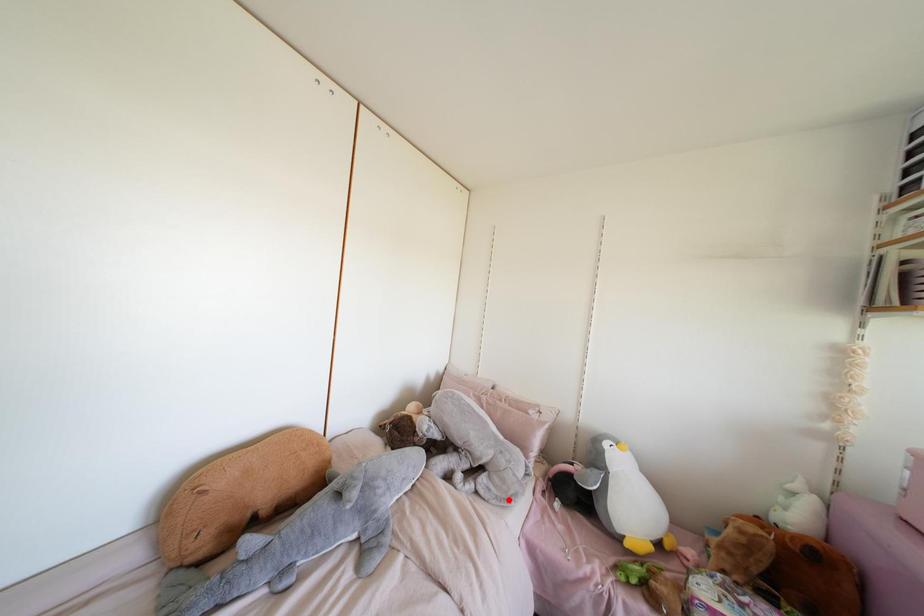
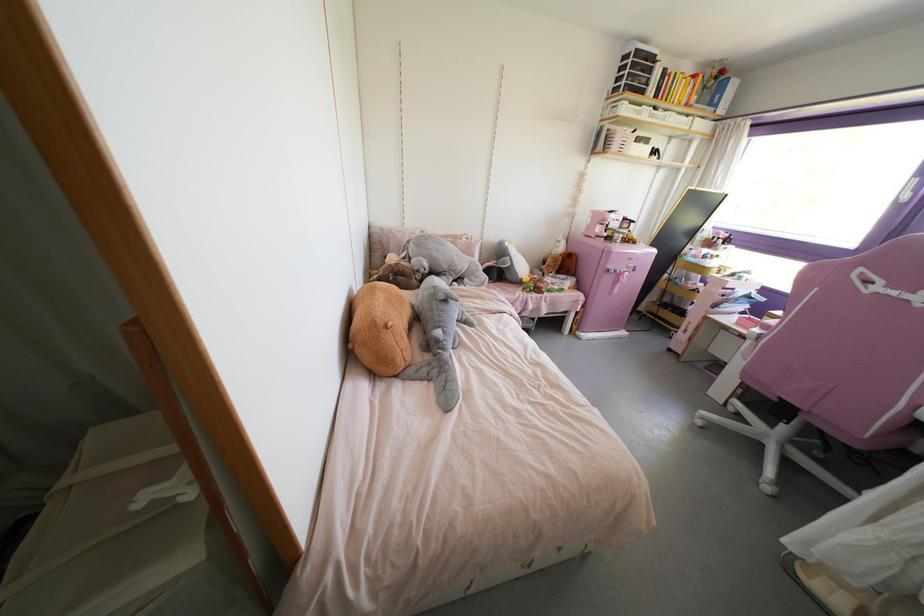
Find the pixel in the second image that matches the highlighted location in the first image.

(482, 284)